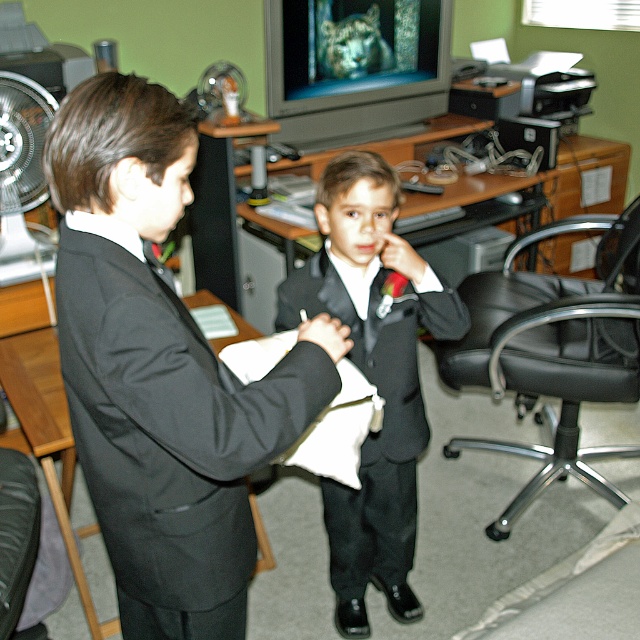
You are an interior designer assessing the space for furniture placement. You notice the shiny black suit at center and the brushed metal fan at left. Which object occupies more space in the room?

The shiny black suit at center is bigger than the brushed metal fan at left, so it occupies more space in the room.

You are a delivery person who needs to place a 1.5 meter long package between the black leather swivel chair at right and the brushed metal fan at left. Can the package fit in the space between them?

The distance between the black leather swivel chair at right and the brushed metal fan at left is 1.64 meters. Since the package is 1.5 meters long, it can fit in the space between them as there is enough room.

You are an interior designer assessing the layout of an office. You notice the matte black suit at center and the brushed metal fan at left. Which object occupies a taller vertical space in the room?

The matte black suit at center is taller than the brushed metal fan at left, so it occupies a greater vertical space in the room.